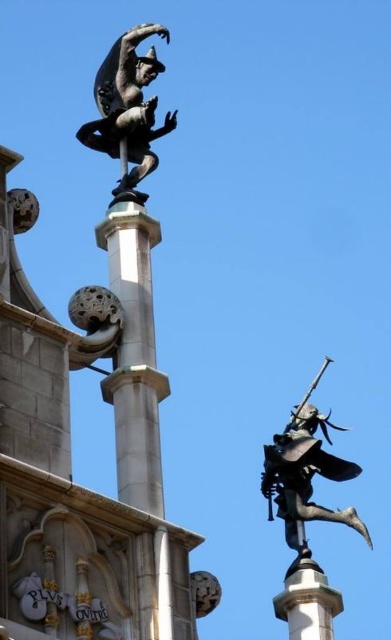
Between point (93, 148) and point (306, 502), which one is positioned in front?

Point (306, 502)

Does polished bronze figure at upper left have a greater width compared to polished bronze figure at upper right?

Yes.

Between point (138, 156) and point (265, 496), which one is positioned behind?

Point (265, 496)

The height and width of the screenshot is (640, 391). What are the coordinates of `polished bronze figure at upper left` in the screenshot? It's located at pyautogui.click(x=127, y=109).